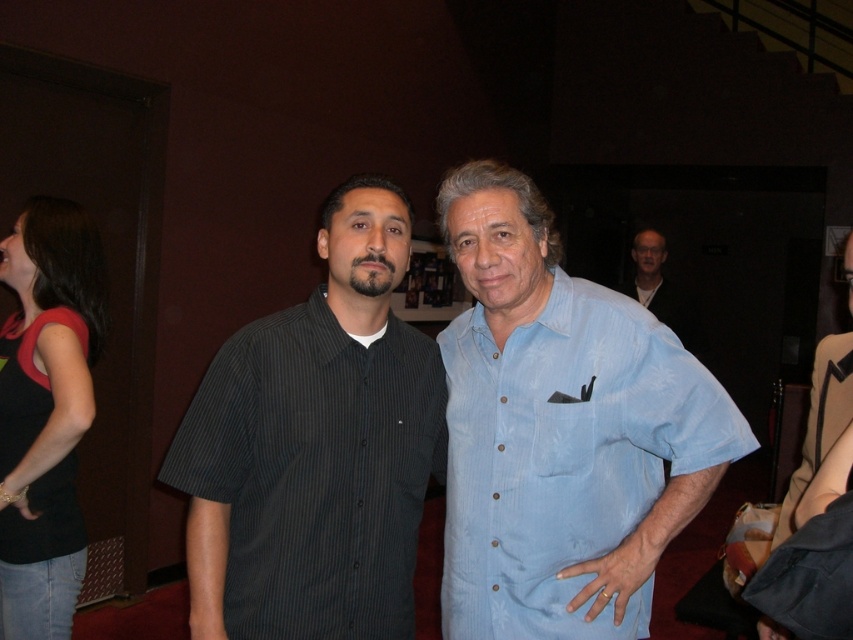
Question: Does black fabric top at left appear on the right side of matte blue shirt at upper right?

Choices:
 (A) yes
 (B) no

Answer: (B)

Question: From the image, what is the correct spatial relationship of light blue cotton shirt at center in relation to dark gray striped shirt at center?

Choices:
 (A) below
 (B) above

Answer: (B)

Question: Is black fabric top at left below matte blue shirt at upper right?

Choices:
 (A) no
 (B) yes

Answer: (B)

Question: Which of the following is the farthest from the observer?

Choices:
 (A) light blue cotton shirt at center
 (B) black fabric top at left

Answer: (B)

Question: Among these objects, which one is nearest to the camera?

Choices:
 (A) light blue cotton shirt at center
 (B) dark gray striped shirt at center

Answer: (A)

Question: Which object appears farthest from the camera in this image?

Choices:
 (A) black fabric top at left
 (B) dark gray striped shirt at center

Answer: (A)